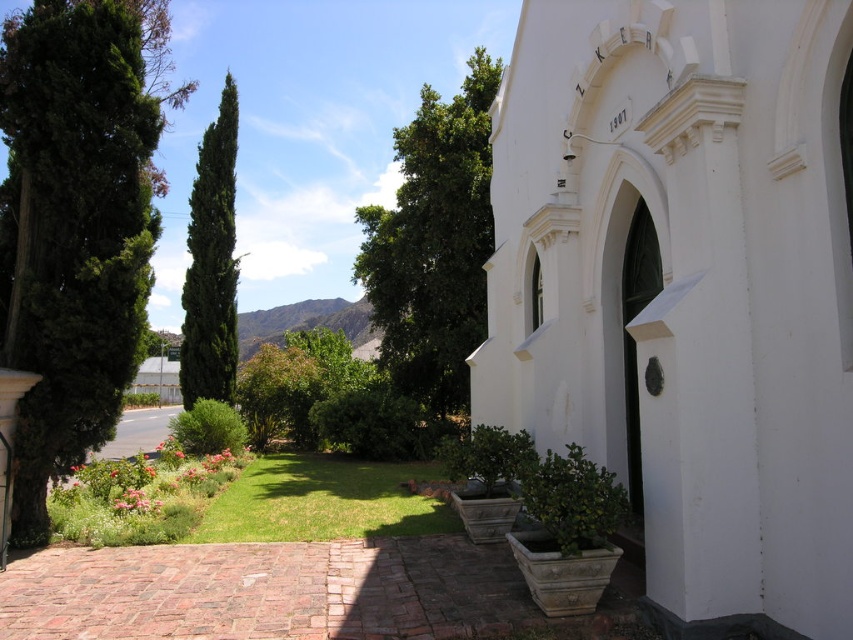
Does green leafy tree at left have a smaller size compared to green leafy tree at center?

Correct, green leafy tree at left occupies less space than green leafy tree at center.

Identify the location of green leafy tree at left. tap(78, 221).

Measure the distance from white smooth church at center to green leafy bush at center.

white smooth church at center and green leafy bush at center are 14.68 meters apart.

Identify the location of white smooth church at center. (686, 289).

Measure the distance between white smooth church at center and camera.

white smooth church at center is 5.71 meters away from camera.

I want to click on white smooth church at center, so click(x=686, y=289).

Is white smooth church at center taller than green leafy tree at center?

In fact, white smooth church at center may be shorter than green leafy tree at center.

Which is in front, point (662, 278) or point (419, 115)?

Point (662, 278) is in front.

Locate an element on the screen. white smooth church at center is located at coordinates (686, 289).